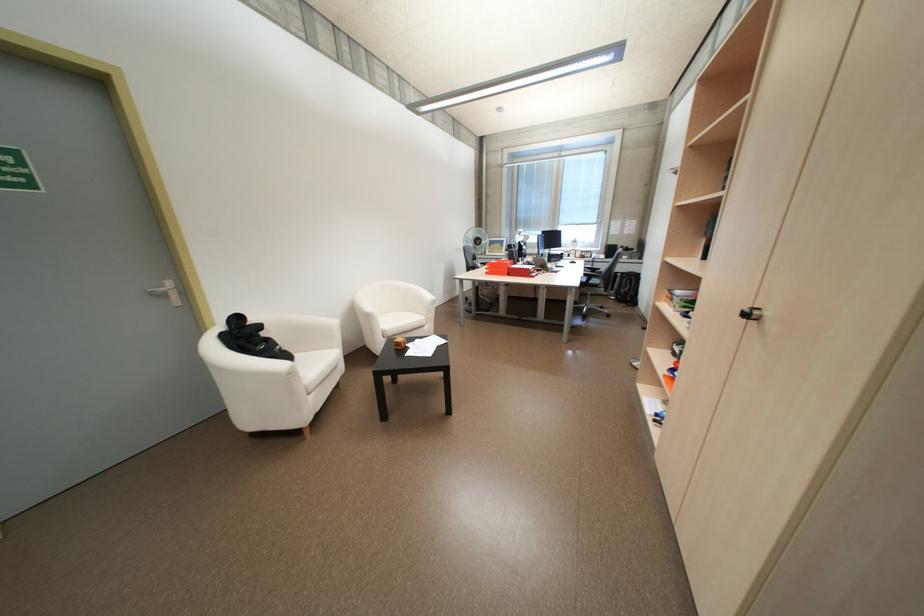
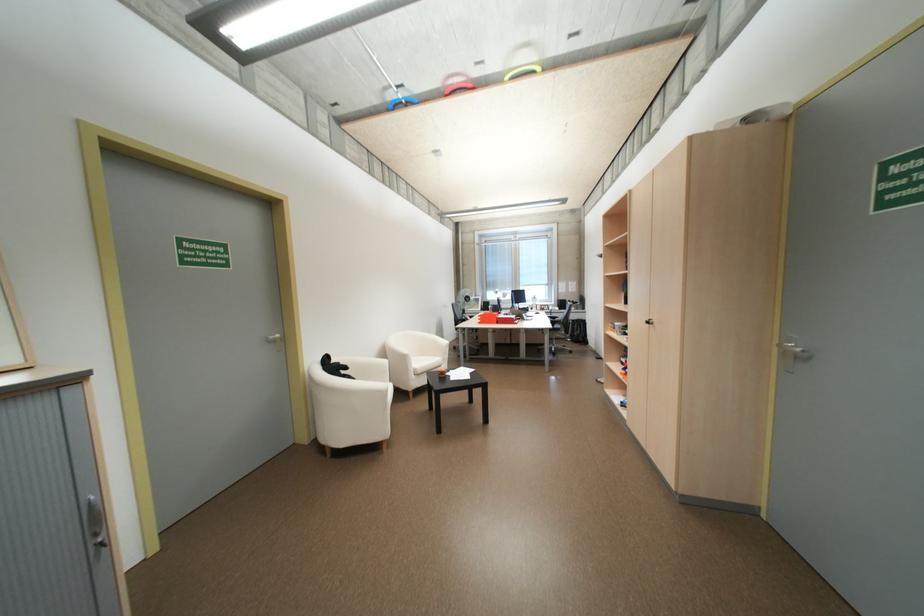
Find the pixel in the second image that matches (393,330) in the first image.

(424, 369)